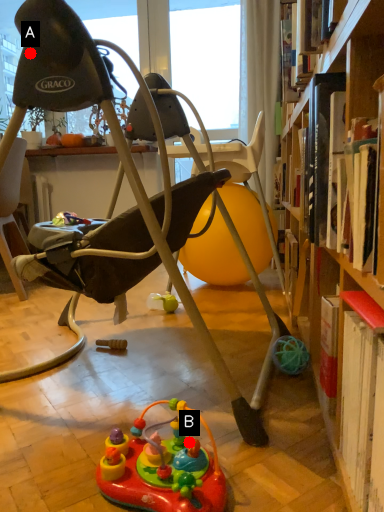
Question: Two points are circled on the image, labeled by A and B beside each circle. Which point is farther from the camera taking this photo?

Choices:
 (A) A is further
 (B) B is further

Answer: (A)